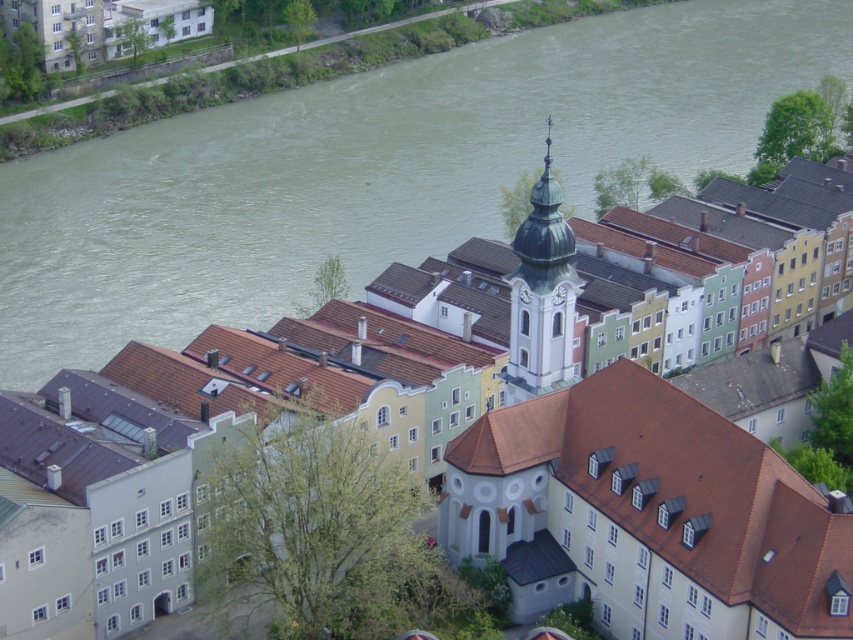
Question: Which point appears farthest from the camera in this image?

Choices:
 (A) (183, 16)
 (B) (300, 292)
 (C) (546, 540)

Answer: (A)

Question: Is green glass spire at center above matte white church at upper left?

Choices:
 (A) no
 (B) yes

Answer: (A)

Question: Which of these objects is positioned farthest from the greenish-gray water at upper left?

Choices:
 (A) matte white church at upper left
 (B) white smooth church at center

Answer: (B)

Question: Is greenish-gray water at upper left to the right of white smooth church at center from the viewer's perspective?

Choices:
 (A) no
 (B) yes

Answer: (A)

Question: Does greenish-gray water at upper left have a smaller size compared to matte white church at upper left?

Choices:
 (A) yes
 (B) no

Answer: (B)

Question: Which of the following is the closest to the observer?

Choices:
 (A) (552, 216)
 (B) (560, 588)
 (C) (120, 138)

Answer: (B)